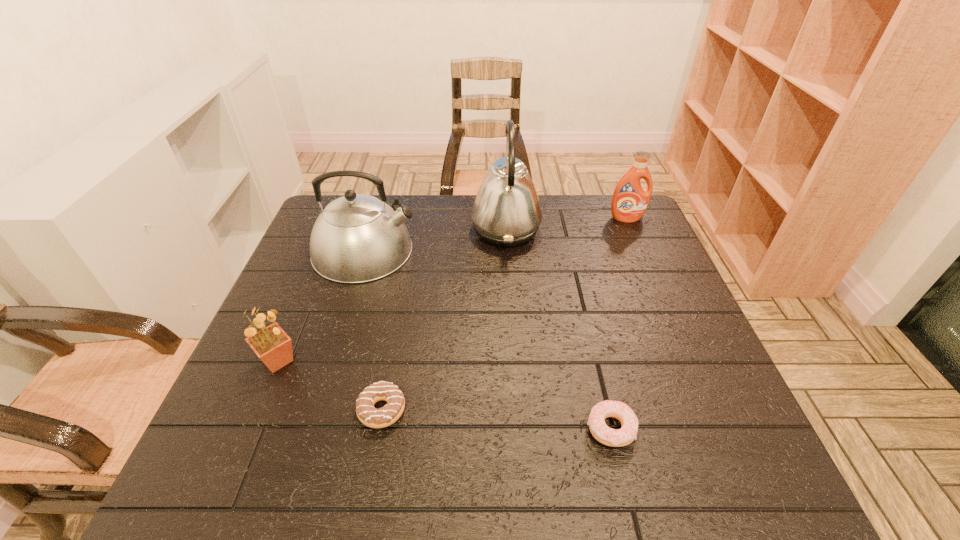
Locate an element on the screen. The width and height of the screenshot is (960, 540). free space that satisfies the following two spatial constraints: 1. at the front of the sunflower with flowers visible; 2. on the left side of the left doughnut is located at coordinates (257, 410).